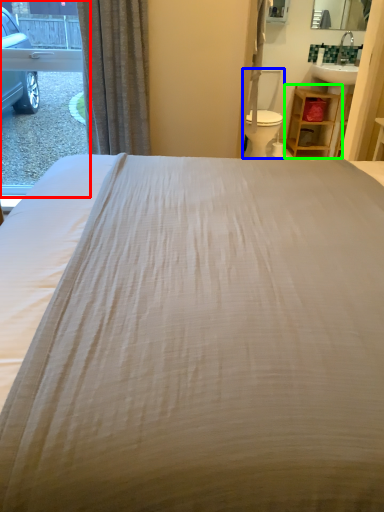
Question: Which object is positioned closest to window (highlighted by a red box)? Select from swivel chair (highlighted by a blue box) and furniture (highlighted by a green box).

Choices:
 (A) swivel chair
 (B) furniture

Answer: (A)